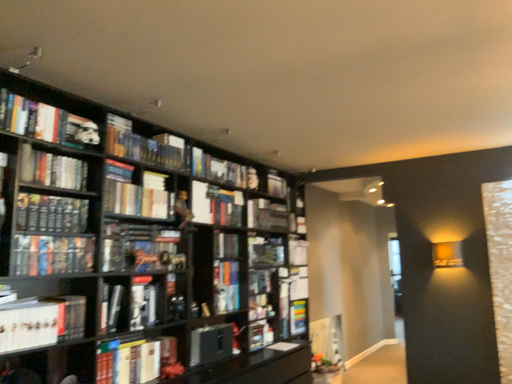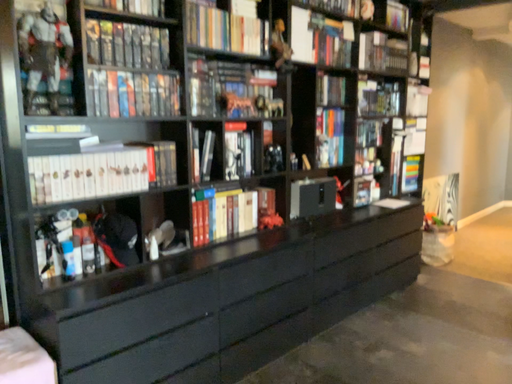
Question: Which way did the camera rotate in the video?

Choices:
 (A) rotated upward
 (B) rotated downward

Answer: (B)